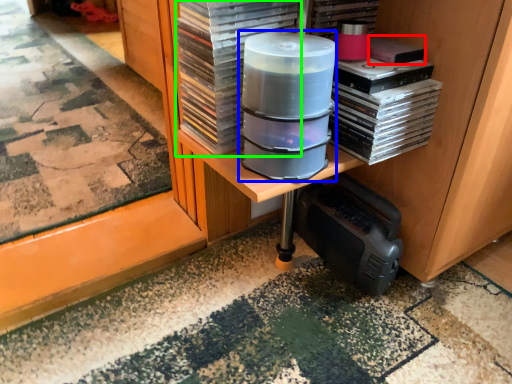
Question: Based on their relative distances, which object is farther from paperback book (highlighted by a red box)? Choose from appliance (highlighted by a blue box) and paperback book (highlighted by a green box).

Choices:
 (A) appliance
 (B) paperback book

Answer: (B)